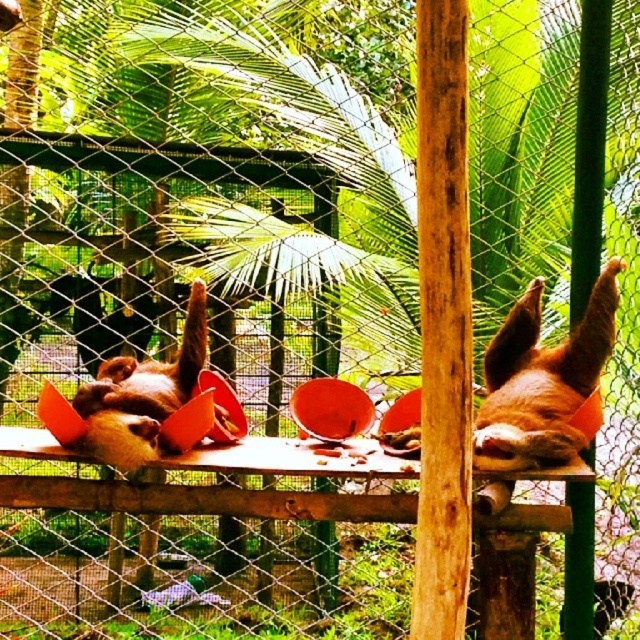
Question: In this image, where is brown furry sloth at right located relative to brown furry sloth at center?

Choices:
 (A) below
 (B) above

Answer: (B)

Question: Which point is closer to the camera taking this photo?

Choices:
 (A) (161, 392)
 (B) (513, 342)

Answer: (A)

Question: Which of the following is the farthest from the observer?

Choices:
 (A) (90, 429)
 (B) (592, 371)

Answer: (B)

Question: Which point appears closest to the camera in this image?

Choices:
 (A) (548, 369)
 (B) (198, 312)

Answer: (A)

Question: In this image, where is brown furry sloth at right located relative to brown furry sloth at center?

Choices:
 (A) left
 (B) right

Answer: (B)

Question: Does brown furry sloth at right appear under brown furry sloth at center?

Choices:
 (A) yes
 (B) no

Answer: (B)